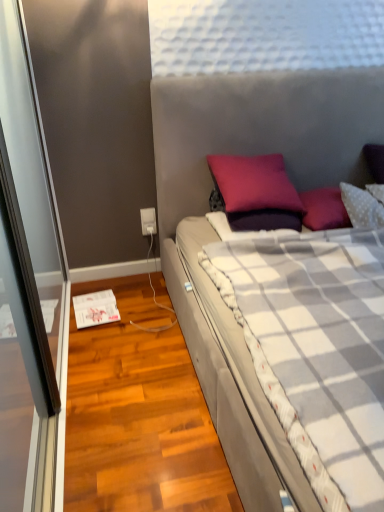
Question: Should I look upward or downward to see white plastic power outlet at lower left?

Choices:
 (A) down
 (B) up

Answer: (B)

Question: Is purple matte pillow at center to the left of white plastic power outlet at lower left from the viewer's perspective?

Choices:
 (A) no
 (B) yes

Answer: (A)

Question: Can you confirm if purple matte pillow at center is bigger than white plastic power outlet at lower left?

Choices:
 (A) yes
 (B) no

Answer: (A)

Question: Does purple matte pillow at center have a smaller size compared to white plastic power outlet at lower left?

Choices:
 (A) yes
 (B) no

Answer: (B)

Question: Is purple matte pillow at center shorter than white plastic power outlet at lower left?

Choices:
 (A) no
 (B) yes

Answer: (A)

Question: Is purple matte pillow at center taller than white plastic power outlet at lower left?

Choices:
 (A) no
 (B) yes

Answer: (B)

Question: Is purple matte pillow at center in contact with white plastic power outlet at lower left?

Choices:
 (A) no
 (B) yes

Answer: (A)

Question: Does white plastic power outlet at lower left have a larger size compared to purple matte pillow at center?

Choices:
 (A) no
 (B) yes

Answer: (A)

Question: From a real-world perspective, is white plastic power outlet at lower left located higher than purple matte pillow at center?

Choices:
 (A) yes
 (B) no

Answer: (B)

Question: Does white plastic power outlet at lower left appear on the right side of purple matte pillow at center?

Choices:
 (A) yes
 (B) no

Answer: (B)

Question: Is white plastic power outlet at lower left outside purple matte pillow at center?

Choices:
 (A) yes
 (B) no

Answer: (A)

Question: From a real-world perspective, is white plastic power outlet at lower left under purple matte pillow at center?

Choices:
 (A) yes
 (B) no

Answer: (A)

Question: Considering the relative sizes of white plastic power outlet at lower left and purple matte pillow at center in the image provided, is white plastic power outlet at lower left thinner than purple matte pillow at center?

Choices:
 (A) no
 (B) yes

Answer: (B)

Question: Is white plastic power outlet at lower left bigger than plush gray bed at center?

Choices:
 (A) yes
 (B) no

Answer: (B)